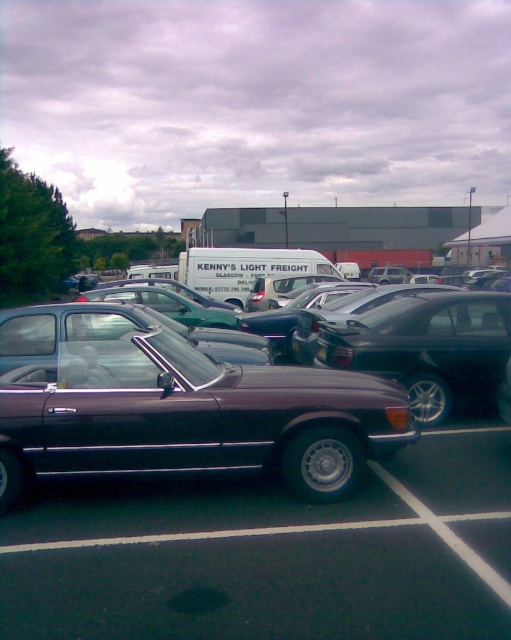
Is shiny maroon convertible at center smaller than shiny dark brown convertible at center?

Yes.

Is shiny maroon convertible at center to the right of shiny dark brown convertible at center from the viewer's perspective?

Correct, you'll find shiny maroon convertible at center to the right of shiny dark brown convertible at center.

This screenshot has height=640, width=511. Find the location of `shiny maroon convertible at center`. shiny maroon convertible at center is located at coordinates (272, 554).

Where is `shiny maroon convertible at center`? shiny maroon convertible at center is located at coordinates (272, 554).